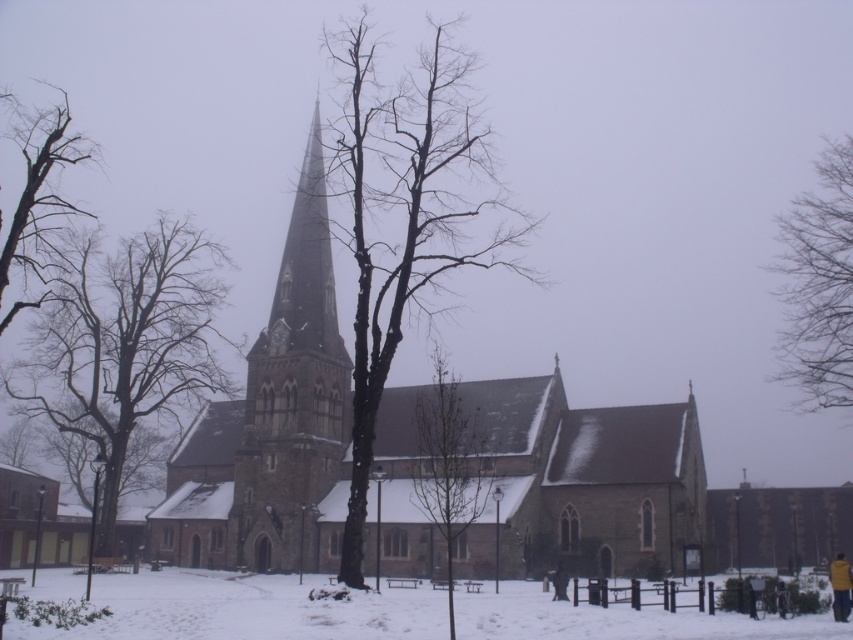
Question: Among these points, which one is nearest to the camera?

Choices:
 (A) (514, 550)
 (B) (316, 260)
 (C) (196, 595)

Answer: (C)

Question: Is smooth bark tree at center to the right of dark blue jacket at lower center from the viewer's perspective?

Choices:
 (A) no
 (B) yes

Answer: (A)

Question: Can you confirm if yellow fabric jacket at lower right is positioned to the right of dark blue jacket at lower center?

Choices:
 (A) yes
 (B) no

Answer: (A)

Question: Does brown stone church at center appear on the left side of dark brown bark tree at left?

Choices:
 (A) yes
 (B) no

Answer: (B)

Question: Which of these objects is positioned closest to the yellow fabric jacket at lower right?

Choices:
 (A) brown stone church at center
 (B) bare wood tree at center

Answer: (B)

Question: Which point appears farthest from the camera in this image?

Choices:
 (A) (448, 420)
 (B) (22, 120)

Answer: (B)